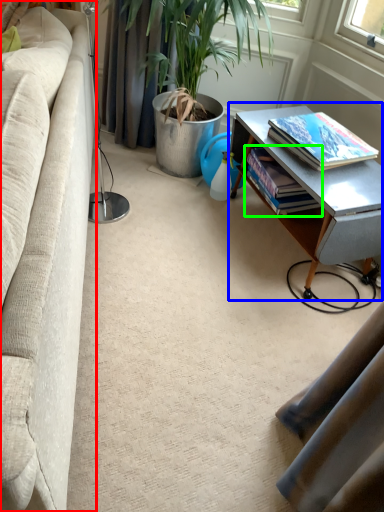
Question: Estimate the real-world distances between objects in this image. Which object is closer to studio couch (highlighted by a red box), table (highlighted by a blue box) or book (highlighted by a green box)?

Choices:
 (A) table
 (B) book

Answer: (A)